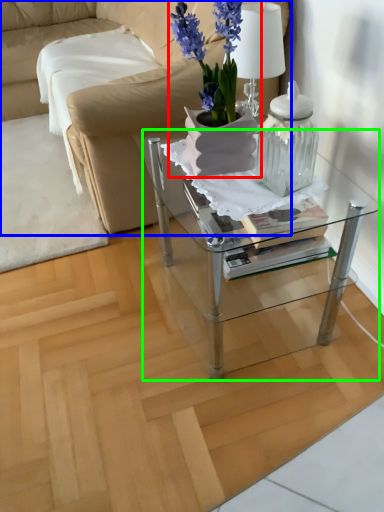
Question: Based on their relative distances, which object is farther from houseplant (highlighted by a red box)? Choose from studio couch (highlighted by a blue box) and table (highlighted by a green box).

Choices:
 (A) studio couch
 (B) table

Answer: (A)